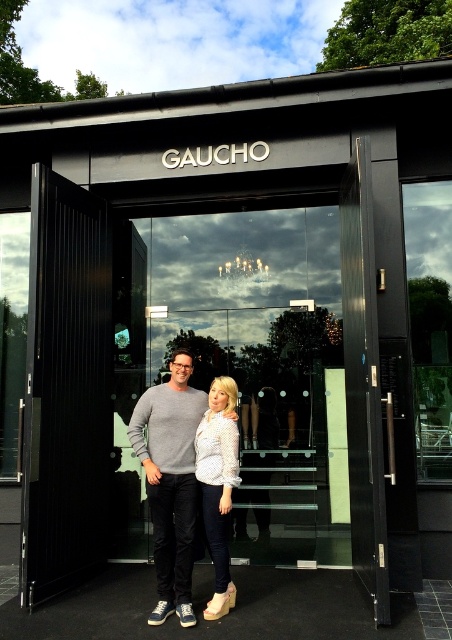
Question: Is transparent glass door at center bigger than white dotted shirt at center?

Choices:
 (A) no
 (B) yes

Answer: (B)

Question: Is light gray sweater at center positioned at the back of white dotted shirt at center?

Choices:
 (A) yes
 (B) no

Answer: (B)

Question: Does transparent glass door at center lie in front of white dotted shirt at center?

Choices:
 (A) no
 (B) yes

Answer: (A)

Question: Which object is the farthest from the transparent glass door at center?

Choices:
 (A) white dotted shirt at center
 (B) light gray sweater at center

Answer: (A)

Question: Which of the following is the farthest from the observer?

Choices:
 (A) (262, 541)
 (B) (192, 369)
 (C) (197, 444)

Answer: (A)

Question: Which object appears closest to the camera in this image?

Choices:
 (A) transparent glass door at center
 (B) white dotted shirt at center

Answer: (B)